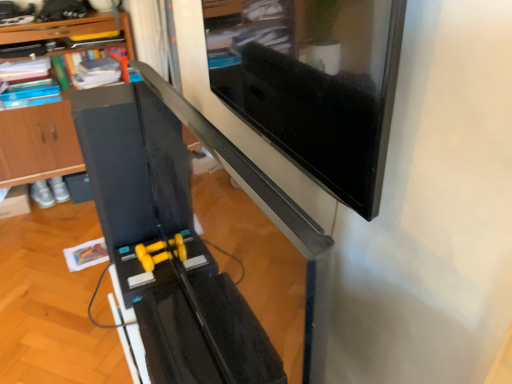
The height and width of the screenshot is (384, 512). What do you see at coordinates (175, 233) in the screenshot?
I see `black glossy computer desk at center` at bounding box center [175, 233].

Identify the location of wooden at left. The width and height of the screenshot is (512, 384). (38, 144).

Is wooden at left wider or thinner than black glossy computer desk at center?

In the image, wooden at left appears to be wider than black glossy computer desk at center.

Considering the relative positions of wooden at left and black glossy computer desk at center in the image provided, is wooden at left in front of black glossy computer desk at center?

No, the depth of wooden at left is greater than that of black glossy computer desk at center.

Is wooden at left next to black glossy computer desk at center?

No, wooden at left is not next to black glossy computer desk at center.

Is black glossy computer desk at center at the back of wooden at left?

That's not correct — wooden at left is not looking away from black glossy computer desk at center.

Is wooden at left spatially inside matte black monitor at upper right, or outside of it?

wooden at left is not inside matte black monitor at upper right, it's outside.

Considering the sizes of objects wooden at left and matte black monitor at upper right in the image provided, who is thinner, wooden at left or matte black monitor at upper right?

matte black monitor at upper right is thinner.

From the image's perspective, between wooden at left and matte black monitor at upper right, which one is located above?

From the image's view, wooden at left is above.

Does wooden at left have a lesser height compared to matte black monitor at upper right?

No, wooden at left is not shorter than matte black monitor at upper right.

Consider the image. Does black glossy computer desk at center have a lesser width compared to matte black monitor at upper right?

No, black glossy computer desk at center is not thinner than matte black monitor at upper right.

Considering the relative positions of black glossy computer desk at center and matte black monitor at upper right in the image provided, is black glossy computer desk at center behind matte black monitor at upper right?

No, black glossy computer desk at center is closer to the camera.

From the image's perspective, would you say black glossy computer desk at center is positioned over matte black monitor at upper right?

Incorrect, from the image's perspective, black glossy computer desk at center is lower than matte black monitor at upper right.

Is black glossy computer desk at center next to matte black monitor at upper right and touching it?

No, black glossy computer desk at center is not beside matte black monitor at upper right.

The width and height of the screenshot is (512, 384). In order to click on computer desk on the right side of wooden at left in this screenshot , I will do `click(175, 233)`.

From the image's perspective, is black glossy computer desk at center located beneath wooden at left?

Indeed, from the image's perspective, black glossy computer desk at center is shown beneath wooden at left.

From a real-world perspective, is black glossy computer desk at center positioned over wooden at left based on gravity?

Yes, from a real-world perspective, black glossy computer desk at center is over wooden at left

Which object is wider, black glossy computer desk at center or wooden at left?

Wider between the two is wooden at left.

In the scene shown: From their relative heights in the image, would you say matte black monitor at upper right is taller or shorter than wooden at left?

Clearly, matte black monitor at upper right is shorter compared to wooden at left.

From a real-world perspective, is matte black monitor at upper right physically above wooden at left?

Yes, from a real-world perspective, matte black monitor at upper right is above wooden at left.

Where is `shelf lying above the matte black monitor at upper right (from the image's perspective)`? This screenshot has height=384, width=512. shelf lying above the matte black monitor at upper right (from the image's perspective) is located at coordinates tap(38, 144).

Considering the relative positions of matte black monitor at upper right and black glossy computer desk at center in the image provided, is matte black monitor at upper right to the right of black glossy computer desk at center from the viewer's perspective?

Yes.

Is matte black monitor at upper right with black glossy computer desk at center?

matte black monitor at upper right and black glossy computer desk at center are not in contact.

Is black glossy computer desk at center at the back of matte black monitor at upper right?

matte black monitor at upper right does not have its back to black glossy computer desk at center.

Considering the relative sizes of matte black monitor at upper right and black glossy computer desk at center in the image provided, is matte black monitor at upper right bigger than black glossy computer desk at center?

No.

I want to click on computer desk on the right of the wooden at left, so click(x=175, y=233).

The height and width of the screenshot is (384, 512). I want to click on computer monitor above the wooden at left (from a real-world perspective), so click(x=314, y=85).

Estimate the real-world distances between objects in this image. Which object is closer to wooden at left, matte black monitor at upper right or black glossy computer desk at center?

black glossy computer desk at center.

Based on their spatial positions, is black glossy computer desk at center or wooden at left further from matte black monitor at upper right?

wooden at left is positioned further to the anchor matte black monitor at upper right.

Looking at the image, which one is located closer to black glossy computer desk at center, wooden at left or matte black monitor at upper right?

matte black monitor at upper right lies closer to black glossy computer desk at center than the other object.

Based on their spatial positions, is wooden at left or black glossy computer desk at center closer to matte black monitor at upper right?

The object closer to matte black monitor at upper right is black glossy computer desk at center.

Looking at the image, which one is located further to wooden at left, black glossy computer desk at center or matte black monitor at upper right?

Based on the image, matte black monitor at upper right appears to be further to wooden at left.

Based on their spatial positions, is matte black monitor at upper right or wooden at left closer to black glossy computer desk at center?

The object closer to black glossy computer desk at center is matte black monitor at upper right.

Locate an element on the screen. This screenshot has height=384, width=512. computer monitor located between black glossy computer desk at center and wooden at left in the depth direction is located at coordinates (314, 85).